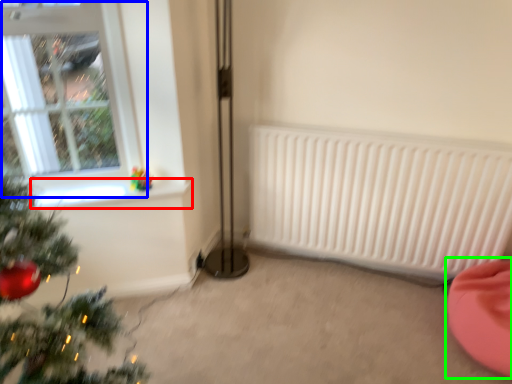
Question: Which is farther away from window sill (highlighted by a red box)? window (highlighted by a blue box) or bean bag chair (highlighted by a green box)?

Choices:
 (A) window
 (B) bean bag chair

Answer: (B)